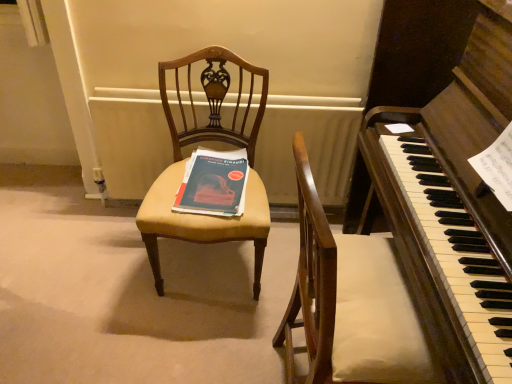
In order to face matte blue paper at center, should I rotate leftwards or rightwards?

To align with it, rotate left about 5.899°.

This screenshot has height=384, width=512. What do you see at coordinates (415, 240) in the screenshot? I see `dark brown polished wood harpsichord at center` at bounding box center [415, 240].

Describe the element at coordinates (308, 144) in the screenshot. This screenshot has width=512, height=384. I see `white painted radiator at center` at that location.

The width and height of the screenshot is (512, 384). I want to click on matte blue paper at center, so click(x=214, y=183).

Is dark brown polished wood harpsichord at center inside or outside of white painted radiator at center?

dark brown polished wood harpsichord at center exists outside the volume of white painted radiator at center.

From a real-world perspective, who is located lower, dark brown polished wood harpsichord at center or white painted radiator at center?

In real-world perspective, white painted radiator at center is lower.

Is dark brown polished wood harpsichord at center aimed at white painted radiator at center?

No, dark brown polished wood harpsichord at center is not turned towards white painted radiator at center.

From the image's perspective, is dark brown polished wood harpsichord at center under white painted radiator at center?

Yes.

In terms of size, does matte yellow fabric chair at center appear bigger or smaller than matte blue paper at center?

Considering their sizes, matte yellow fabric chair at center takes up more space than matte blue paper at center.

Which is in front, matte yellow fabric chair at center or matte blue paper at center?

matte yellow fabric chair at center is more forward.

Is matte yellow fabric chair at center thinner than matte blue paper at center?

No, matte yellow fabric chair at center is not thinner than matte blue paper at center.

Does white painted radiator at center have a lesser width compared to matte blue paper at center?

Indeed, white painted radiator at center has a lesser width compared to matte blue paper at center.

Considering the positions of objects white painted radiator at center and matte blue paper at center in the image provided, who is more to the left, white painted radiator at center or matte blue paper at center?

matte blue paper at center.

Is white painted radiator at center closer to camera compared to matte blue paper at center?

No, white painted radiator at center is behind matte blue paper at center.

Considering the relative positions of matte blue paper at center and dark brown polished wood harpsichord at center in the image provided, is matte blue paper at center to the left of dark brown polished wood harpsichord at center from the viewer's perspective?

Indeed, matte blue paper at center is positioned on the left side of dark brown polished wood harpsichord at center.

Looking at their sizes, would you say matte blue paper at center is wider or thinner than dark brown polished wood harpsichord at center?

matte blue paper at center is thinner than dark brown polished wood harpsichord at center.

Relative to dark brown polished wood harpsichord at center, is matte blue paper at center in front or behind?

Visually, matte blue paper at center is located behind dark brown polished wood harpsichord at center.

Looking at the image, does matte blue paper at center seem bigger or smaller compared to dark brown polished wood harpsichord at center?

Considering their sizes, matte blue paper at center takes up less space than dark brown polished wood harpsichord at center.

Is white painted radiator at center taller than matte yellow fabric chair at center?

A: No, white painted radiator at center is not taller than matte yellow fabric chair at center.

Is white painted radiator at center located outside matte yellow fabric chair at center?

Yes, white painted radiator at center is located beyond the bounds of matte yellow fabric chair at center.

Which of these two, white painted radiator at center or matte yellow fabric chair at center, is wider?

Wider between the two is matte yellow fabric chair at center.

Is point (116, 146) closer to viewer compared to point (264, 95)?

No, (116, 146) is further to viewer.

Does matte yellow fabric chair at center contain white painted radiator at center?

Actually, white painted radiator at center is outside matte yellow fabric chair at center.

Which of these two, matte yellow fabric chair at center or white painted radiator at center, is wider?

matte yellow fabric chair at center is wider.

Is point (253, 208) closer to viewer compared to point (109, 155)?

Yes.

Are matte yellow fabric chair at center and white painted radiator at center far apart?

That's not correct — matte yellow fabric chair at center is a little close to white painted radiator at center.

Is white painted radiator at center next to dark brown polished wood harpsichord at center?

white painted radiator at center and dark brown polished wood harpsichord at center are clearly separated.

In the scene shown: From the image's perspective, between white painted radiator at center and dark brown polished wood harpsichord at center, which one is located above?

From the image's view, white painted radiator at center is above.

From a real-world perspective, does white painted radiator at center stand above dark brown polished wood harpsichord at center?

No, from a real-world perspective, white painted radiator at center is not over dark brown polished wood harpsichord at center

In the scene shown: Which of these two, white painted radiator at center or dark brown polished wood harpsichord at center, is thinner?

With smaller width is white painted radiator at center.

You are a GUI agent. You are given a task and a screenshot of the screen. Output one action in this format:
    pyautogui.click(x=<x>, y=<y>)
    Task: Click on the harpsichord lying on the right of white painted radiator at center
    The width and height of the screenshot is (512, 384).
    Given the screenshot: What is the action you would take?
    pyautogui.click(x=415, y=240)

The height and width of the screenshot is (384, 512). In order to click on chair located in front of the matte blue paper at center in this screenshot , I will do `click(183, 171)`.

Considering their positions, is white painted radiator at center positioned further to dark brown polished wood harpsichord at center than matte blue paper at center?

Among the two, white painted radiator at center is located further to dark brown polished wood harpsichord at center.

Which object lies further to the anchor point white painted radiator at center, matte yellow fabric chair at center or matte blue paper at center?

matte blue paper at center lies further to white painted radiator at center than the other object.

From the image, which object appears to be farther from matte yellow fabric chair at center, dark brown polished wood harpsichord at center or white painted radiator at center?

Among the two, dark brown polished wood harpsichord at center is located further to matte yellow fabric chair at center.

Which object lies nearer to the anchor point white painted radiator at center, dark brown polished wood harpsichord at center or matte blue paper at center?

matte blue paper at center.

Looking at the image, which one is located further to matte yellow fabric chair at center, dark brown polished wood harpsichord at center or matte blue paper at center?

dark brown polished wood harpsichord at center is further to matte yellow fabric chair at center.

Estimate the real-world distances between objects in this image. Which object is closer to dark brown polished wood harpsichord at center, matte yellow fabric chair at center or white painted radiator at center?

The object closer to dark brown polished wood harpsichord at center is matte yellow fabric chair at center.

From the picture: From the image, which object appears to be farther from matte yellow fabric chair at center, white painted radiator at center or dark brown polished wood harpsichord at center?

dark brown polished wood harpsichord at center is further to matte yellow fabric chair at center.

Which object lies further to the anchor point matte blue paper at center, dark brown polished wood harpsichord at center or white painted radiator at center?

dark brown polished wood harpsichord at center is positioned further to the anchor matte blue paper at center.

Locate an element on the screen. The width and height of the screenshot is (512, 384). chair located between dark brown polished wood harpsichord at center and white painted radiator at center in the depth direction is located at coordinates (183, 171).

You are a GUI agent. You are given a task and a screenshot of the screen. Output one action in this format:
    pyautogui.click(x=<x>, y=<y>)
    Task: Click on the paperback book situated between matte yellow fabric chair at center and dark brown polished wood harpsichord at center from left to right
    Image resolution: width=512 pixels, height=384 pixels.
    Given the screenshot: What is the action you would take?
    pyautogui.click(x=214, y=183)

The image size is (512, 384). What are the coordinates of `paperback book between dark brown polished wood harpsichord at center and white painted radiator at center along the z-axis` in the screenshot? It's located at (214, 183).

Where is `paperback book between matte yellow fabric chair at center and white painted radiator at center in the front-back direction`? The width and height of the screenshot is (512, 384). paperback book between matte yellow fabric chair at center and white painted radiator at center in the front-back direction is located at coordinates (214, 183).